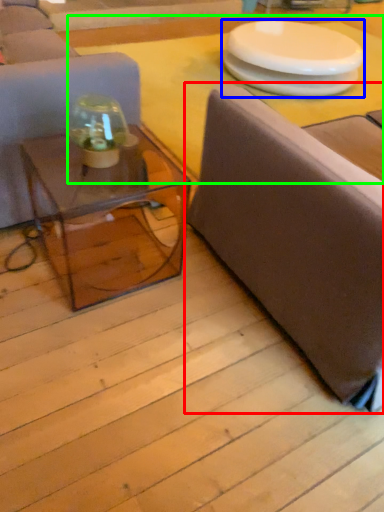
Question: Estimate the real-world distances between objects in this image. Which object is closer to studio couch (highlighted by a red box), round table (highlighted by a blue box) or table top (highlighted by a green box)?

Choices:
 (A) round table
 (B) table top

Answer: (B)